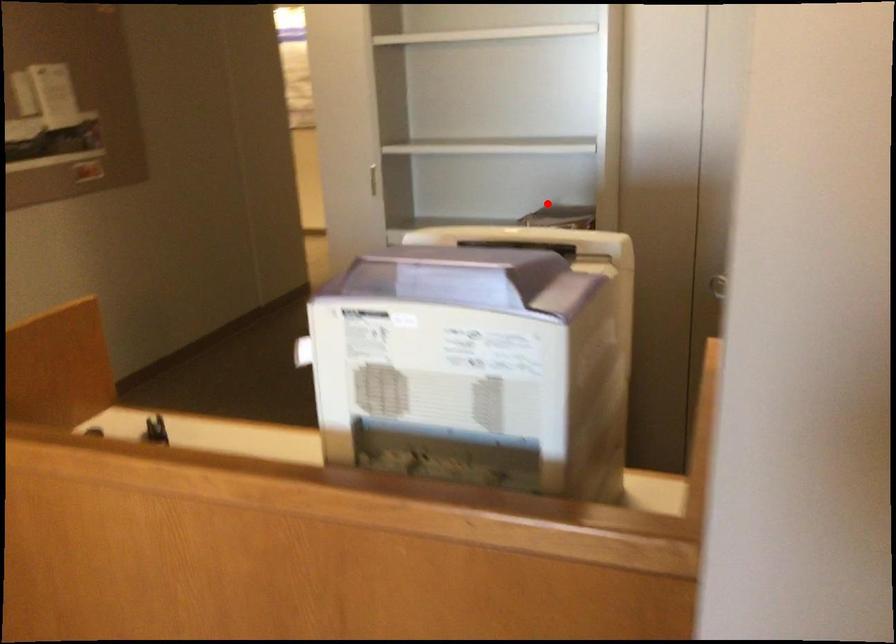
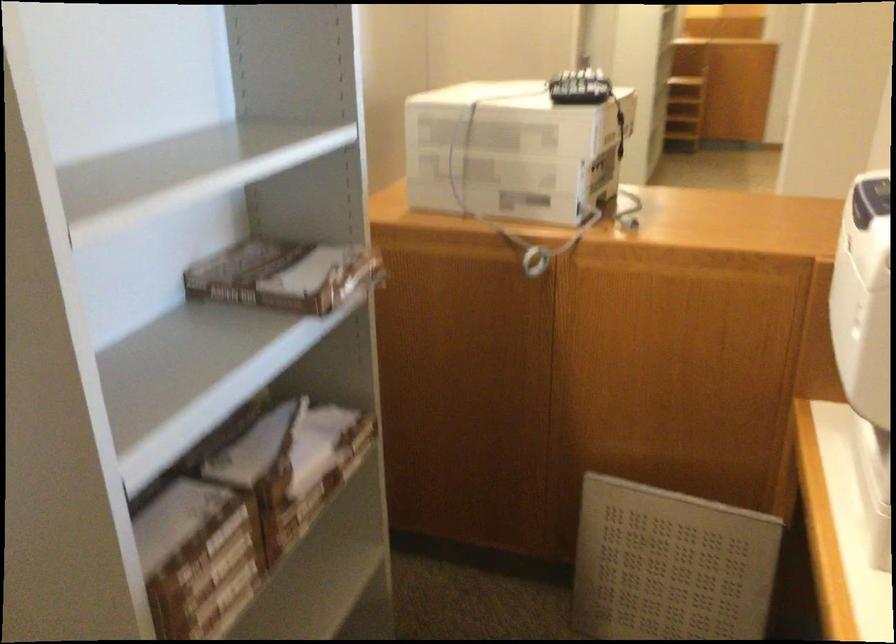
The point at the highlighted location is marked in the first image. Where is the corresponding point in the second image?

(280, 275)